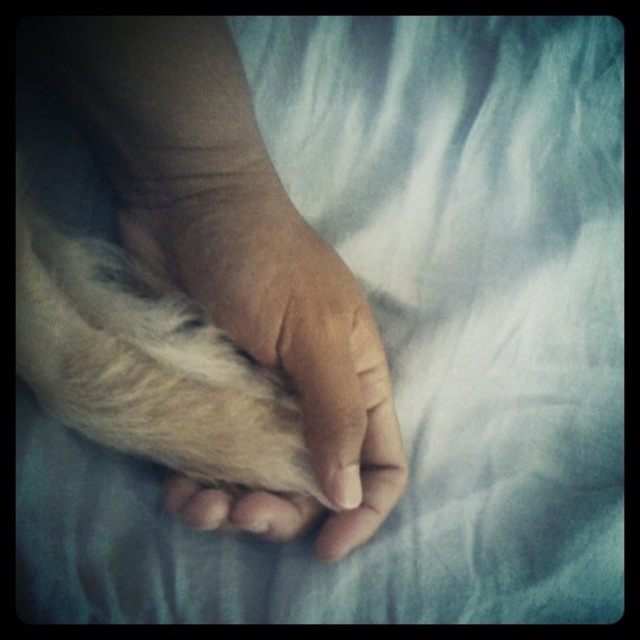
Question: Does dry skin paw at center lie in front of fuzzy white fur at center?

Choices:
 (A) no
 (B) yes

Answer: (B)

Question: Is dry skin paw at center below fuzzy white fur at center?

Choices:
 (A) no
 (B) yes

Answer: (A)

Question: Does dry skin paw at center appear over fuzzy white fur at center?

Choices:
 (A) yes
 (B) no

Answer: (A)